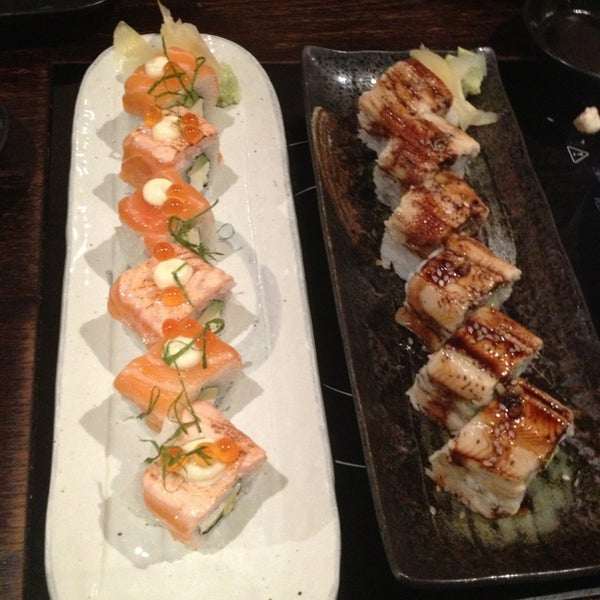
Where is `table`? The height and width of the screenshot is (600, 600). table is located at coordinates (42, 380).